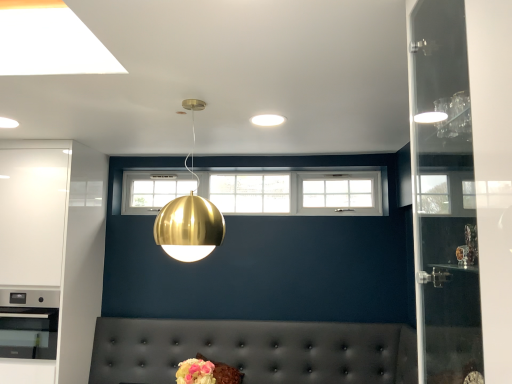
Question: Is tufted leather couch at lower center located outside gold metallic sphere at center?

Choices:
 (A) yes
 (B) no

Answer: (A)

Question: Is tufted leather couch at lower center at the left side of gold metallic sphere at center?

Choices:
 (A) no
 (B) yes

Answer: (B)

Question: Could you tell me if tufted leather couch at lower center is facing gold metallic sphere at center?

Choices:
 (A) yes
 (B) no

Answer: (B)

Question: Is tufted leather couch at lower center in front of gold metallic sphere at center?

Choices:
 (A) yes
 (B) no

Answer: (B)

Question: Does tufted leather couch at lower center touch gold metallic sphere at center?

Choices:
 (A) no
 (B) yes

Answer: (A)

Question: Visually, is gold metallic sphere at center positioned to the left or to the right of white matte light fixture at center?

Choices:
 (A) right
 (B) left

Answer: (B)

Question: Is gold metallic sphere at center wider or thinner than white matte light fixture at center?

Choices:
 (A) thin
 (B) wide

Answer: (B)

Question: In the image, is gold metallic sphere at center positioned in front of or behind white matte light fixture at center?

Choices:
 (A) front
 (B) behind

Answer: (A)

Question: Is point (205, 221) closer or farther from the camera than point (282, 117)?

Choices:
 (A) closer
 (B) farther

Answer: (A)

Question: Is tufted leather couch at lower center taller or shorter than white glossy cabinet at left?

Choices:
 (A) tall
 (B) short

Answer: (B)

Question: Would you say tufted leather couch at lower center is to the left or to the right of white glossy cabinet at left in the picture?

Choices:
 (A) left
 (B) right

Answer: (B)

Question: From a real-world perspective, is tufted leather couch at lower center positioned above or below white glossy cabinet at left?

Choices:
 (A) below
 (B) above

Answer: (A)

Question: From the image's perspective, is tufted leather couch at lower center located above or below white glossy cabinet at left?

Choices:
 (A) above
 (B) below

Answer: (B)

Question: Is white glossy cabinet at left wider or thinner than white matte light fixture at center?

Choices:
 (A) thin
 (B) wide

Answer: (B)

Question: Is white glossy cabinet at left inside or outside of white matte light fixture at center?

Choices:
 (A) outside
 (B) inside

Answer: (A)